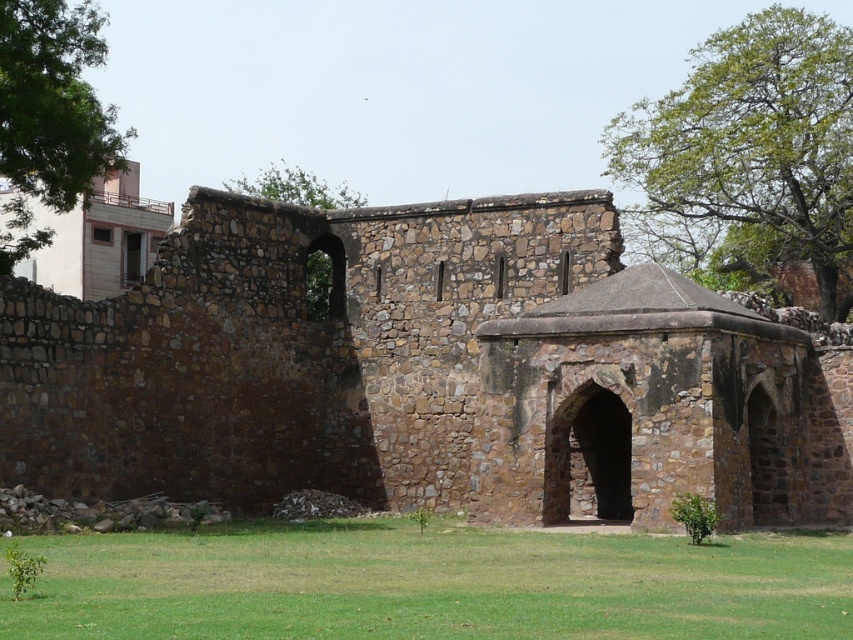
You are an archaeologist examining the ancient stone structure. You notice two green leafy trees in the upper part of the image. Which tree is closer to you, the green leafy tree at upper right or the green leafy tree at upper center?

The green leafy tree at upper right is closer to you because it is in front of the green leafy tree at upper center.

You are an archaeologist examining the ancient stone structure. You notice a green leafy tree at upper right. Based on its position, can you determine if the tree is closer to the archway on the right or the collapsed section of the wall?

The green leafy tree at upper right is located at point (747, 156), which places it closer to the archway on the right compared to the collapsed section of the wall.

You are standing in front of the ancient stone structure and notice the green grass at lower center and the green leafy tree at upper center. Which object is closer to the ground?

The green grass at lower center is closer to the ground as it is located below the green leafy tree at upper center.